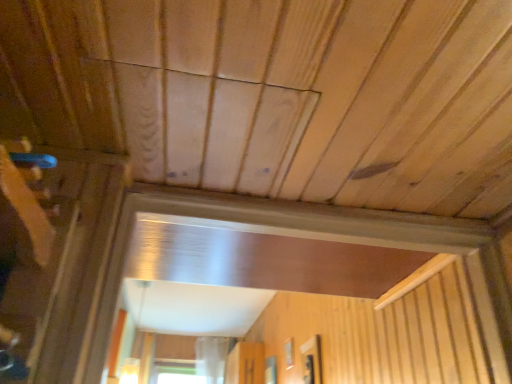
Describe the element at coordinates (289, 353) in the screenshot. I see `transparent glass window at center, which is the 2th window from front to back` at that location.

This screenshot has width=512, height=384. I want to click on transparent plastic screen door at center, so click(245, 364).

The image size is (512, 384). What do you see at coordinates (311, 361) in the screenshot? I see `transparent glass window at center, the 3th window in the back-to-front sequence` at bounding box center [311, 361].

Where is `transparent glass window at center, acting as the 2th window starting from the left`? transparent glass window at center, acting as the 2th window starting from the left is located at coordinates (289, 353).

Where is `screen door below the transparent glass window at center, which is the first window from left to right (from the image's perspective)`? Image resolution: width=512 pixels, height=384 pixels. screen door below the transparent glass window at center, which is the first window from left to right (from the image's perspective) is located at coordinates (245, 364).

Considering the points (271, 367) and (246, 350), which point is in front, point (271, 367) or point (246, 350)?

The point (271, 367) is more forward.

Is transparent glass window at center, the third window from the front, not within transparent plastic screen door at center?

transparent glass window at center, the third window from the front, is positioned outside transparent plastic screen door at center.

Is point (287, 365) positioned behind point (265, 375)?

No, (287, 365) is closer to viewer.

In the image, is transparent glass window at center, the second window positioned from the right, positioned in front of or behind transparent glass window at center, the third window from the front?

In the image, transparent glass window at center, the second window positioned from the right, appears in front of transparent glass window at center, the third window from the front.

Is transparent glass window at center, the 3th window positioned from the left, placed right next to transparent glass window at center, which is the first window from left to right?

transparent glass window at center, the 3th window positioned from the left, and transparent glass window at center, which is the first window from left to right, are clearly separated.

Does transparent glass window at center, positioned as the 1th window in front-to-back order, have a greater height compared to transparent glass window at center, which is the first window from left to right?

Yes.

Is transparent glass window at center, which ranks as the third window in right-to-left order, at the back of transparent glass window at center, the 3th window in the back-to-front sequence?

No, transparent glass window at center, the 3th window in the back-to-front sequence, is not facing away from transparent glass window at center, which ranks as the third window in right-to-left order.

Considering the positions of objects transparent plastic screen door at center and transparent glass window at center, which is counted as the first window, starting from the back, in the image provided, who is in front, transparent plastic screen door at center or transparent glass window at center, which is counted as the first window, starting from the back,?

transparent glass window at center, which is counted as the first window, starting from the back, is more forward.

Which is closer to the camera, (244,369) or (271,372)?

Point (244,369) appears to be farther away from the viewer than point (271,372).

In the scene shown: Are transparent plastic screen door at center and transparent glass window at center, which is counted as the first window, starting from the back, located far from each other?

No, there isn't a large distance between transparent plastic screen door at center and transparent glass window at center, which is counted as the first window, starting from the back.

From a real-world perspective, relative to transparent glass window at center, which is the first window from left to right, is transparent plastic screen door at center vertically above or below?

transparent plastic screen door at center is situated higher than transparent glass window at center, which is the first window from left to right, in the real world.

Is the depth of transparent plastic screen door at center greater than that of transparent glass window at center, acting as the 2th window starting from the left?

That is True.

From the image's perspective, which is below, transparent plastic screen door at center or transparent glass window at center, the second window positioned from the right?

transparent plastic screen door at center appears lower in the image.

Where is `the 2nd window counting from the right of the transparent plastic screen door at center`? This screenshot has width=512, height=384. the 2nd window counting from the right of the transparent plastic screen door at center is located at coordinates (289, 353).

Looking at this image, who is bigger, transparent plastic screen door at center or transparent glass window at center, acting as the 2th window starting from the left?

With larger size is transparent plastic screen door at center.

How many degrees apart are the facing directions of transparent plastic screen door at center and transparent glass window at center, the 3th window positioned from the left?

transparent plastic screen door at center and transparent glass window at center, the 3th window positioned from the left, are facing 1.31 degrees away from each other.

Is transparent plastic screen door at center wider or thinner than transparent glass window at center, the 3th window in the back-to-front sequence?

Considering their sizes, transparent plastic screen door at center looks broader than transparent glass window at center, the 3th window in the back-to-front sequence.

Which object is more forward, transparent plastic screen door at center or transparent glass window at center, which is the 1th window in right-to-left order?

transparent glass window at center, which is the 1th window in right-to-left order, is closer to the camera.

Find the location of `screen door located below the transparent glass window at center, which is the 1th window in right-to-left order (from the image's perspective)`. screen door located below the transparent glass window at center, which is the 1th window in right-to-left order (from the image's perspective) is located at coordinates coord(245,364).

From a real-world perspective, which is physically below, transparent glass window at center, the 3th window positioned from the left, or transparent glass window at center, the second window positioned from the right?

Result: transparent glass window at center, the 3th window positioned from the left.

From the image's perspective, is transparent glass window at center, which is the 1th window in right-to-left order, above transparent glass window at center, acting as the 2th window starting from the left?

Correct, transparent glass window at center, which is the 1th window in right-to-left order, appears higher than transparent glass window at center, acting as the 2th window starting from the left, in the image.

Is transparent glass window at center, the 3th window positioned from the left, aimed at transparent glass window at center, arranged as the second window when viewed from the back?

No.

Considering the relative positions of transparent glass window at center, which is the 1th window in right-to-left order, and transparent glass window at center, acting as the 2th window starting from the left, in the image provided, is transparent glass window at center, which is the 1th window in right-to-left order, to the left or to the right of transparent glass window at center, acting as the 2th window starting from the left,?

transparent glass window at center, which is the 1th window in right-to-left order, is positioned on transparent glass window at center, acting as the 2th window starting from the left,'s right side.

Starting from the transparent plastic screen door at center, which window is the 1st one to the right? Please provide its 2D coordinates.

[(271, 370)]

From the image's perspective, count 1st windows upward from the transparent glass window at center, which is the first window from left to right, and point to it. Please provide its 2D coordinates.

[(289, 353)]

When comparing their distances from transparent glass window at center, which is counted as the first window, starting from the back, does transparent glass window at center, the second window positioned from the right, or transparent glass window at center, the 3th window positioned from the left, seem closer?

transparent glass window at center, the second window positioned from the right, is closer to transparent glass window at center, which is counted as the first window, starting from the back.

Based on the photo, when comparing their distances from transparent glass window at center, which is the first window from left to right, does transparent plastic screen door at center or transparent glass window at center, positioned as the 1th window in front-to-back order, seem further?

The object further to transparent glass window at center, which is the first window from left to right, is transparent glass window at center, positioned as the 1th window in front-to-back order.

From the image, which object appears to be farther from transparent plastic screen door at center, transparent glass window at center, which is the 1th window in right-to-left order, or transparent glass window at center, which is the 2th window from front to back?

transparent glass window at center, which is the 1th window in right-to-left order, lies further to transparent plastic screen door at center than the other object.

Estimate the real-world distances between objects in this image. Which object is closer to transparent glass window at center, the 3th window positioned from the left, transparent plastic screen door at center or transparent glass window at center, which is the first window from left to right?

transparent glass window at center, which is the first window from left to right, is positioned closer to the anchor transparent glass window at center, the 3th window positioned from the left.

Based on the photo, considering their positions, is transparent glass window at center, which is the 1th window in right-to-left order, positioned closer to transparent glass window at center, which is the 2th window from front to back, than transparent plastic screen door at center?

transparent glass window at center, which is the 1th window in right-to-left order, is positioned closer to the anchor transparent glass window at center, which is the 2th window from front to back.

In the scene shown: When comparing their distances from transparent glass window at center, which ranks as the third window in right-to-left order, does transparent plastic screen door at center or transparent glass window at center, which is the 2th window from front to back, seem further?

transparent glass window at center, which is the 2th window from front to back, is positioned further to the anchor transparent glass window at center, which ranks as the third window in right-to-left order.

From the image, which object appears to be farther from transparent glass window at center, which is counted as the first window, starting from the back, transparent glass window at center, the 3th window in the back-to-front sequence, or transparent plastic screen door at center?

transparent glass window at center, the 3th window in the back-to-front sequence.

Considering their positions, is transparent glass window at center, the third window from the front, positioned further to transparent plastic screen door at center than transparent glass window at center, the 3th window in the back-to-front sequence?

transparent glass window at center, the 3th window in the back-to-front sequence, is positioned further to the anchor transparent plastic screen door at center.

Identify the location of window positioned between transparent glass window at center, acting as the 2th window starting from the left, and transparent plastic screen door at center from near to far. (271, 370).

Locate an element on the screen. The height and width of the screenshot is (384, 512). window positioned between transparent glass window at center, which is the 1th window in right-to-left order, and transparent glass window at center, which is counted as the first window, starting from the back, from near to far is located at coordinates (289, 353).